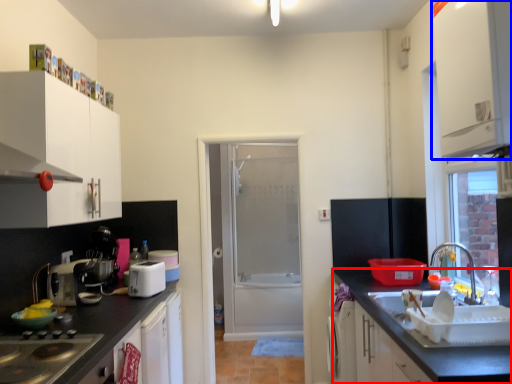
Question: Which point is closer to the camera, countertop (highlighted by a red box) or cabinetry (highlighted by a blue box)?

Choices:
 (A) countertop
 (B) cabinetry

Answer: (A)